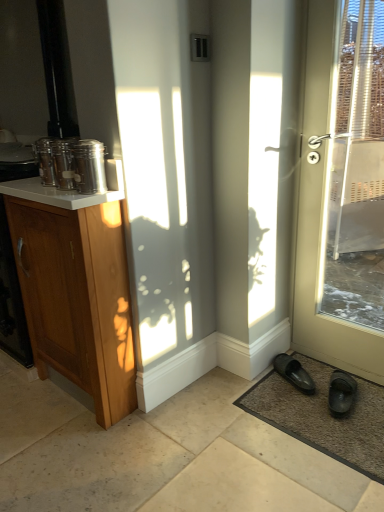
At what (x,y) coordinates should I click in order to perform the action: click on free spot below brown textured mat at lower right (from a real-world perspective). Please return your answer as a coordinate pair (x, y). Image resolution: width=384 pixels, height=512 pixels. Looking at the image, I should click on point(330,422).